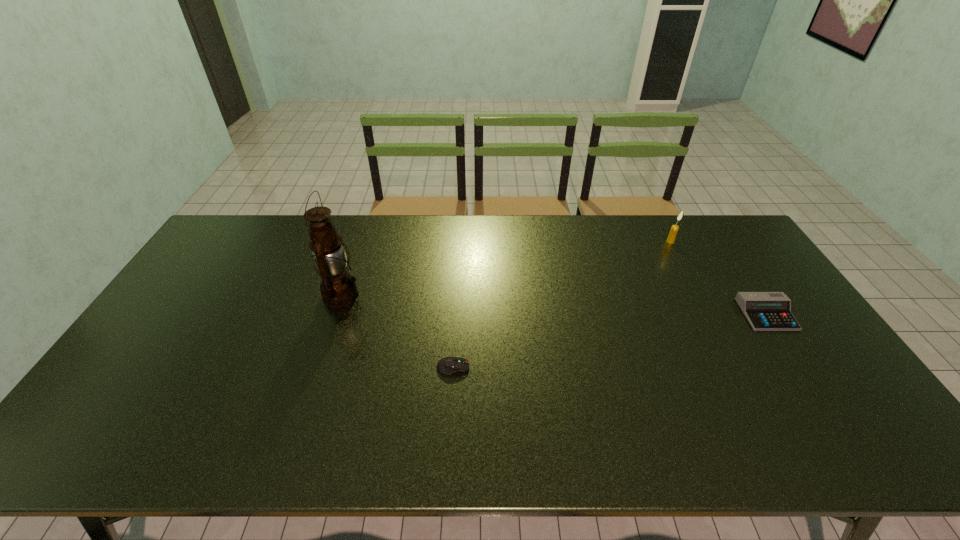
Where is `vacant region located 0.110m on the back of the second shortest object`? This screenshot has width=960, height=540. vacant region located 0.110m on the back of the second shortest object is located at coordinates (741, 275).

Where is `free location located on the button of the computer equipment`? The height and width of the screenshot is (540, 960). free location located on the button of the computer equipment is located at coordinates (620, 367).

At what (x,y) coordinates should I click in order to perform the action: click on object that is at the far edge. Please return your answer as a coordinate pair (x, y). Looking at the image, I should click on (674, 229).

At what (x,y) coordinates should I click in order to perform the action: click on object that is at the right edge. Please return your answer as a coordinate pair (x, y). The width and height of the screenshot is (960, 540). Looking at the image, I should click on (765, 311).

The height and width of the screenshot is (540, 960). Find the location of `free space at the far edge of the desktop`. free space at the far edge of the desktop is located at coordinates (430, 248).

In the image, there is a desktop. Where is `vacant space at the near edge`? vacant space at the near edge is located at coordinates (231, 455).

Identify the location of vacant space at the left edge of the desktop. (104, 392).

Find the location of a particular element. Image resolution: width=960 pixels, height=540 pixels. free spot at the right edge of the desktop is located at coordinates (742, 279).

You are a GUI agent. You are given a task and a screenshot of the screen. Output one action in this format:
    pyautogui.click(x=<x>, y=<y>)
    Task: Click on the free space at the far right corner of the desktop
    The image size is (960, 540).
    Given the screenshot: What is the action you would take?
    pyautogui.click(x=738, y=247)

The height and width of the screenshot is (540, 960). Find the location of `empty location between the tallest object and the shortest object`. empty location between the tallest object and the shortest object is located at coordinates (397, 331).